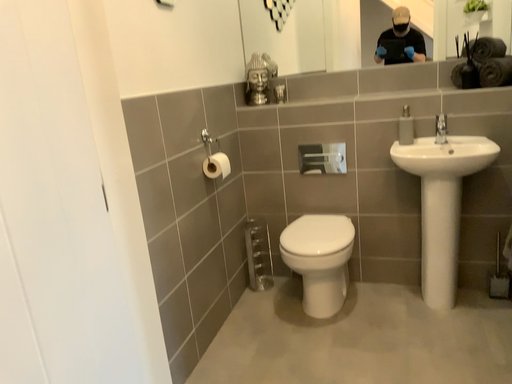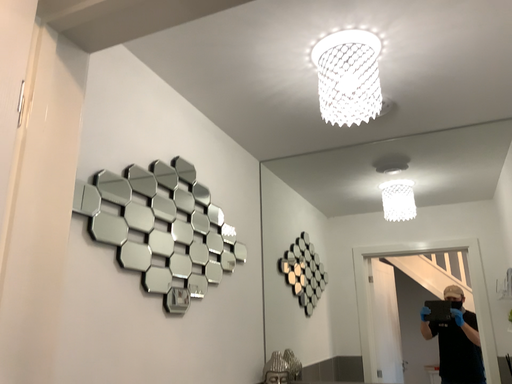
Question: How did the camera likely rotate when shooting the video?

Choices:
 (A) rotated downward
 (B) rotated upward

Answer: (B)